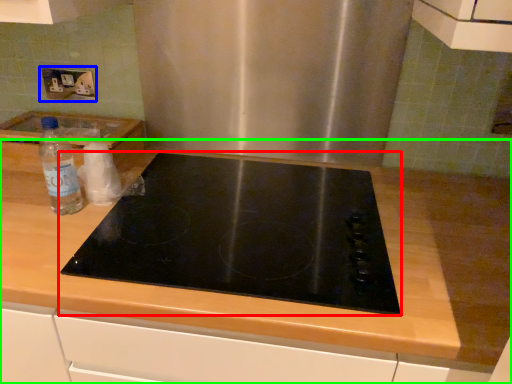
Question: Considering the real-world distances, which object is closest to gas stove (highlighted by a red box)? electric outlet (highlighted by a blue box) or countertop (highlighted by a green box).

Choices:
 (A) electric outlet
 (B) countertop

Answer: (B)